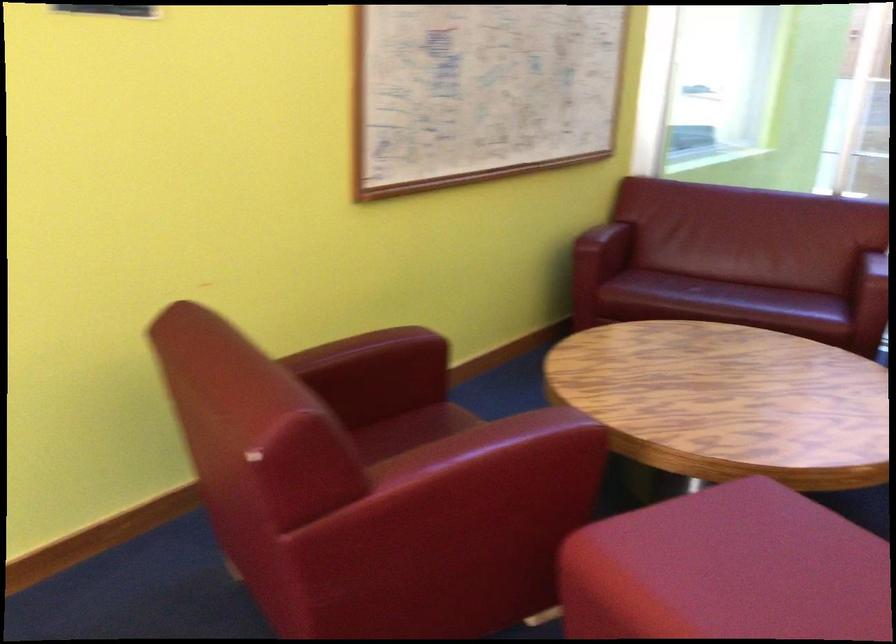
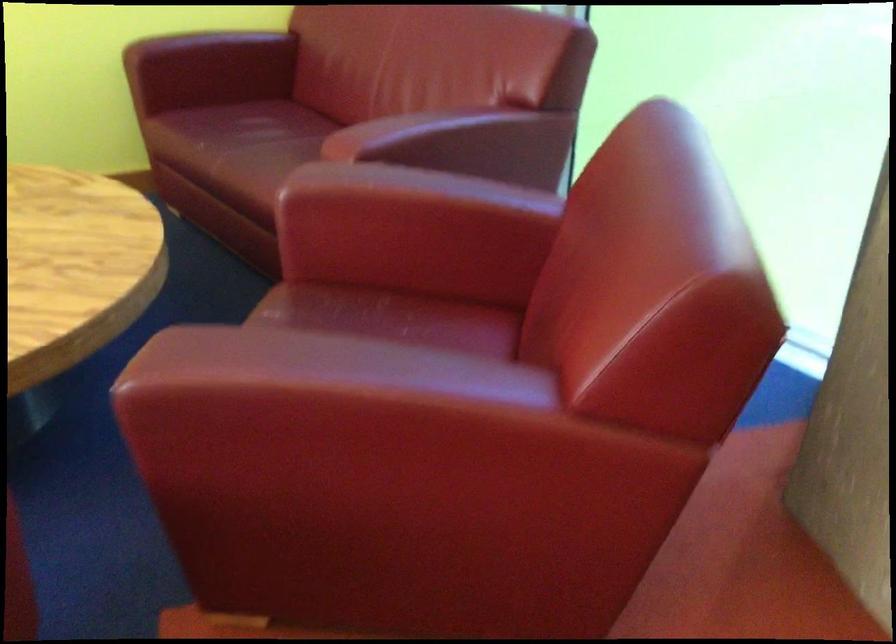
Locate, in the second image, the point that corresponds to point (698, 281) in the first image.

(263, 131)